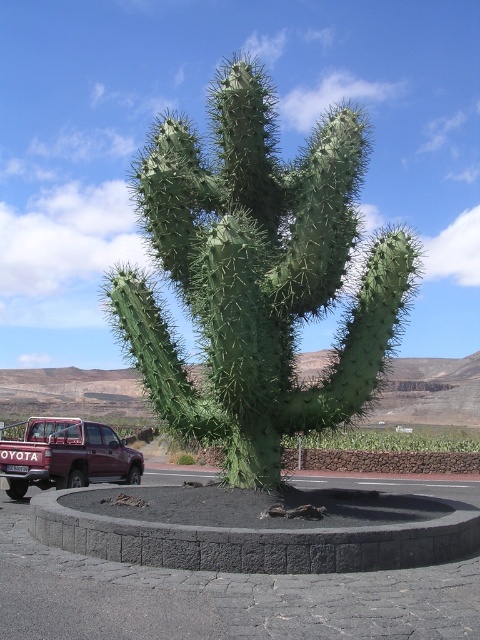
You are standing in the desert and see the matte black pickup truck at center and the maroon metallic truck at lower left. Which truck is positioned more to the east if the sun is setting in the west?

The matte black pickup truck at center is to the right of the maroon metallic truck at lower left. Since the sun is setting in the west, the right side of the image corresponds to the east. Therefore, the matte black pickup truck at center is positioned more to the east.

You are standing in front of the cactus sculpture and want to take a photo that includes both the red Toyota pickup truck and the cactus. To ensure both are in focus, you need to know which point is closer to you. Which point, point (x=332, y=202) or point (x=113, y=540), is closer to your current position?

Point (x=113, y=540) is closer to your current position because the description states that point (x=332, y=202) is further to the camera than point (x=113, y=540).